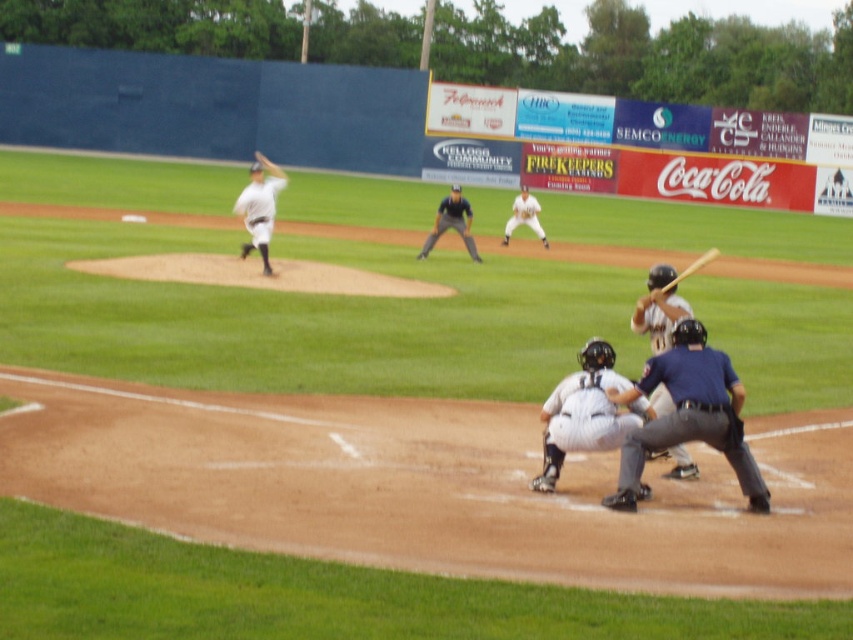
Is white matte uniform at center shorter than dark gray uniform at center?

Yes, white matte uniform at center is shorter than dark gray uniform at center.

Which is behind, point (634, 413) or point (448, 209)?

The point (448, 209) is behind.

Which is behind, point (573, 435) or point (426, 250)?

The point (426, 250) is behind.

The image size is (853, 640). I want to click on white matte uniform at center, so click(585, 412).

Is point (575, 444) positioned behind point (660, 300)?

That is False.

I want to click on white matte uniform at center, so click(585, 412).

Can you confirm if white matte bat at center is taller than white matte baseball player at center?

In fact, white matte bat at center may be shorter than white matte baseball player at center.

Is white matte bat at center closer to the viewer compared to white matte baseball player at center?

Yes, it is.

This screenshot has width=853, height=640. Describe the element at coordinates (659, 308) in the screenshot. I see `white matte bat at center` at that location.

Where is `white matte bat at center`? The width and height of the screenshot is (853, 640). white matte bat at center is located at coordinates (659, 308).